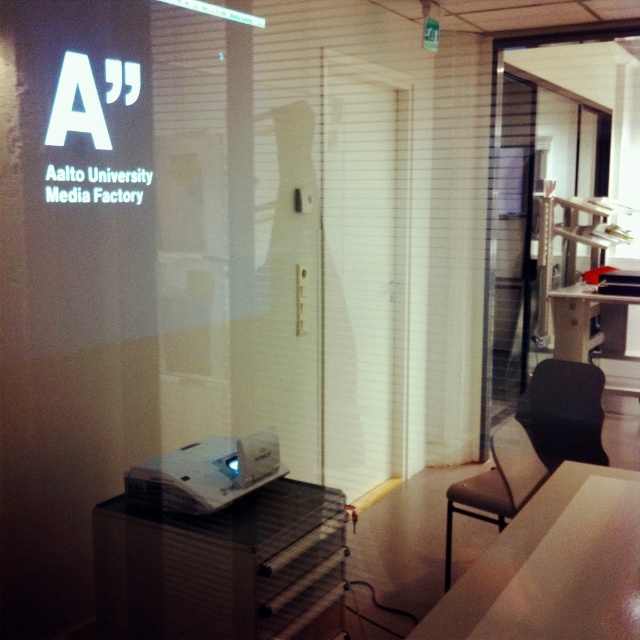
Can you confirm if transparent glass door at upper right is bigger than black leather chair at right?

Yes, transparent glass door at upper right is bigger than black leather chair at right.

Locate an element on the screen. The image size is (640, 640). transparent glass door at upper right is located at coordinates (556, 180).

Does point (541, 579) come closer to viewer compared to point (145, 502)?

Yes, point (541, 579) is closer to viewer.

Looking at this image, between white glossy table at lower right and white plastic projector at lower center, which one appears on the left side from the viewer's perspective?

From the viewer's perspective, white plastic projector at lower center appears more on the left side.

Is point (512, 628) closer to viewer compared to point (134, 476)?

Yes.

Find the location of a particular element. This screenshot has height=640, width=640. white glossy table at lower right is located at coordinates (554, 566).

Can you confirm if white plastic projector at lower center is positioned below glossy plastic table at center?

Yes.

Where is `white plastic projector at lower center`? Image resolution: width=640 pixels, height=640 pixels. white plastic projector at lower center is located at coordinates (204, 474).